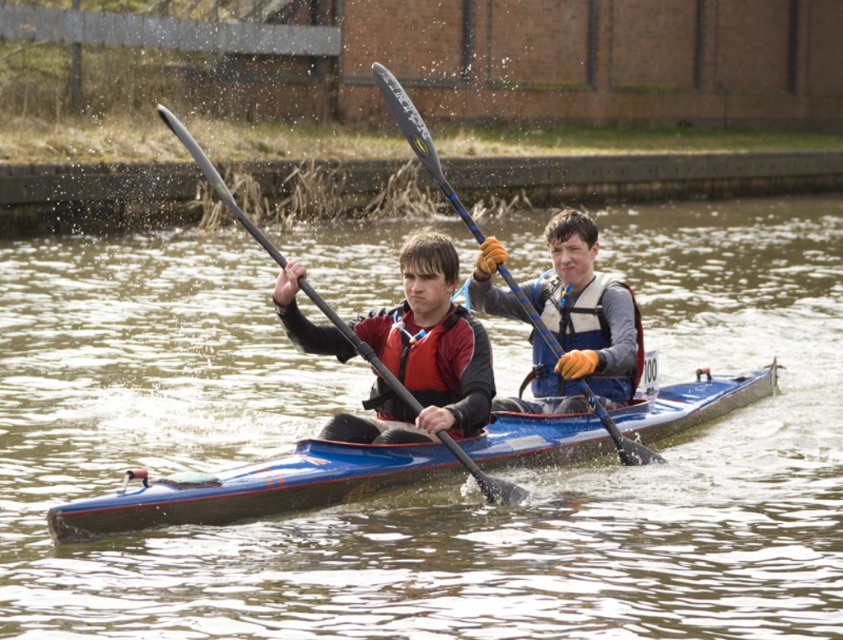
You are planning to rent a kayak for a family of four. The rental company has two options available in the image. Which kayak, the blue glossy kayak at center or the matte blue kayak at center, can accommodate more people?

The blue glossy kayak at center is bigger than the matte blue kayak at center, so it can accommodate more people.

You are navigating a kayak with two people. The front paddler is at point (471, 376) and the back paddler is at point (158, 109). Which paddler is closer to the direction you are heading?

The front paddler at point (471, 376) is closer to the direction you are heading because they are positioned in front of the back paddler at point (158, 109).